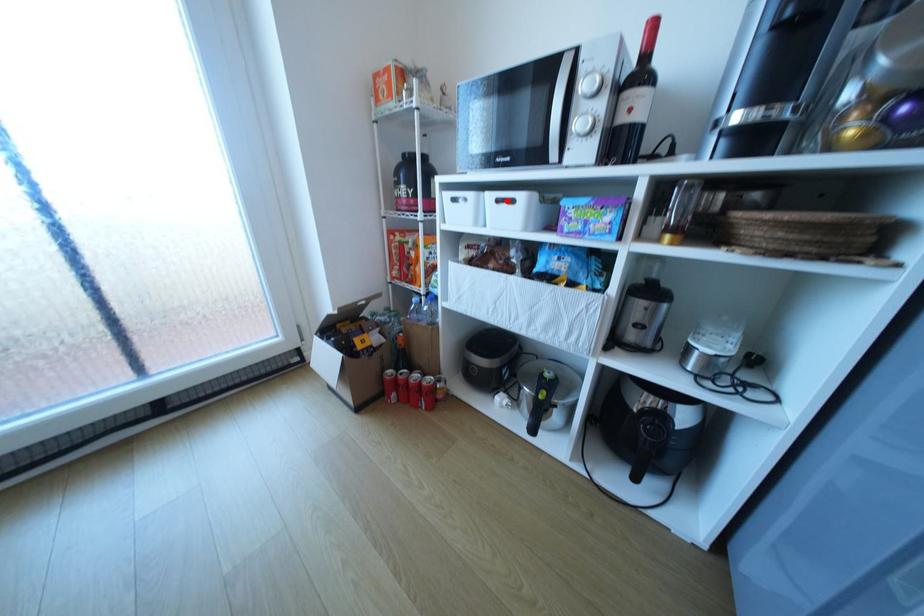
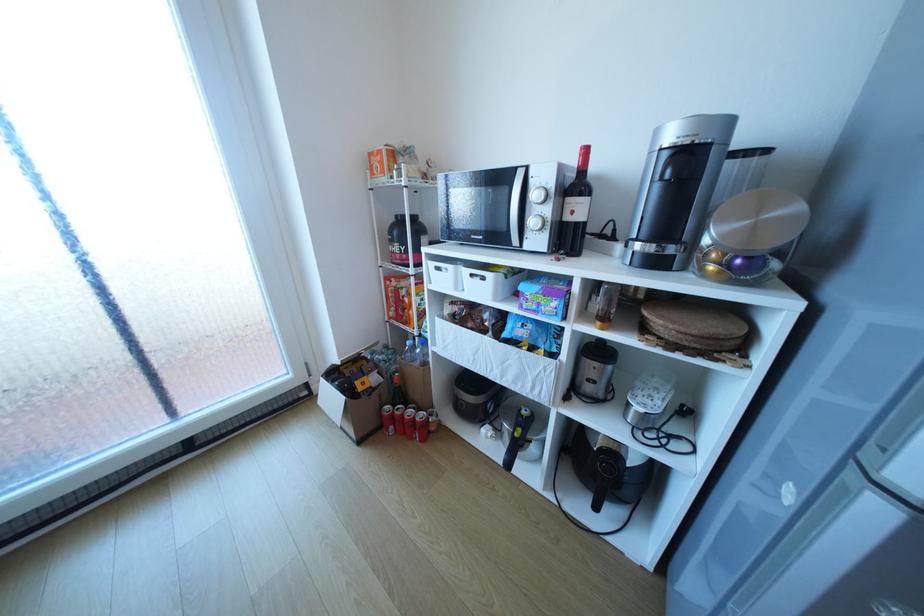
In the second image, find the point that corresponds to the highlighted location in the first image.

(481, 275)